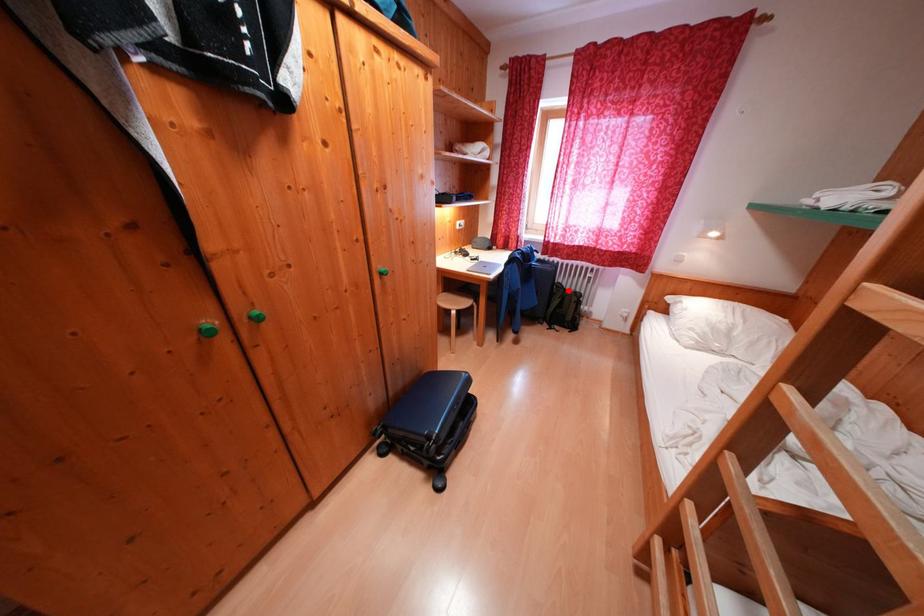
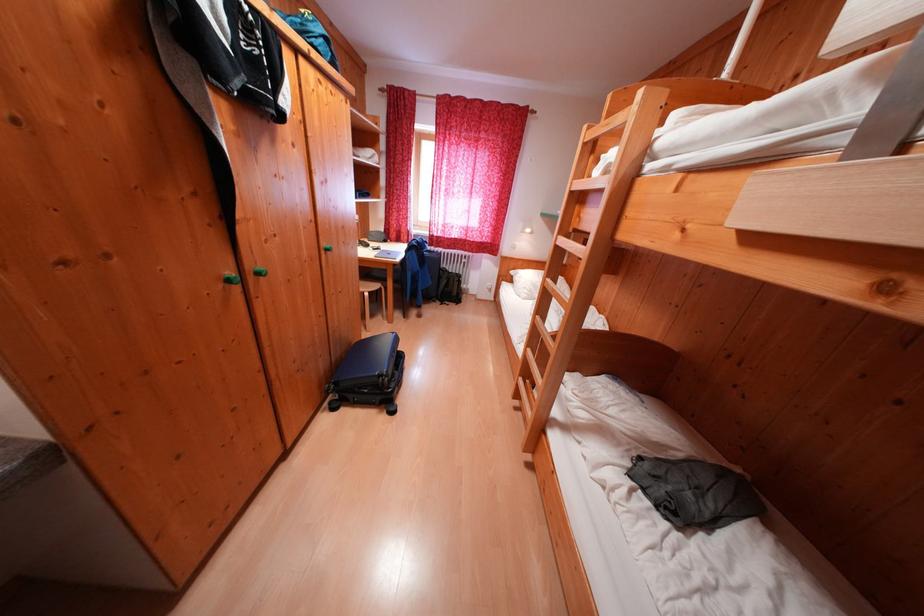
The point at the highlighted location is marked in the first image. Where is the corresponding point in the second image?

(454, 275)